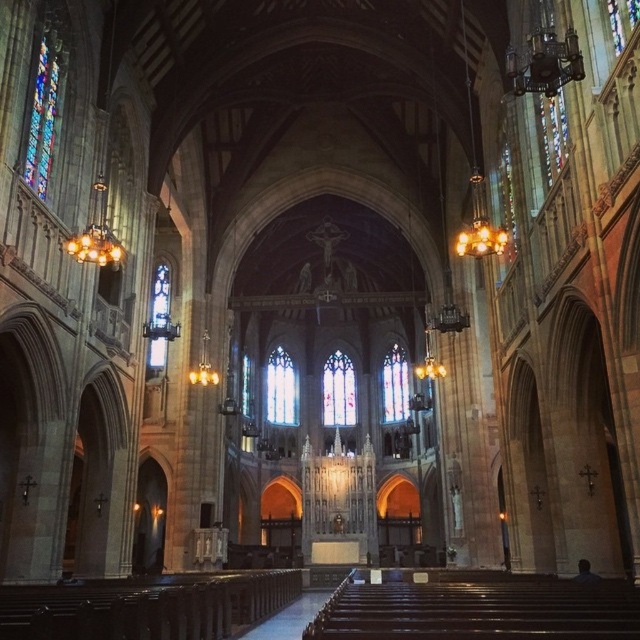
Is point (28, 173) more distant than point (154, 339)?

No, it is not.

Is stained glass window at upper left thinner than clear glass stained glass window at left?

Correct, stained glass window at upper left's width is less than clear glass stained glass window at left's.

Which is behind, point (42, 180) or point (150, 314)?

The point (150, 314) is more distant.

Identify the location of stained glass window at upper left. (44, 113).

Between stained glass window at upper left and stained glass window at center, which one appears on the left side from the viewer's perspective?

From the viewer's perspective, stained glass window at upper left appears more on the left side.

Measure the distance between point (48,138) and camera.

196.34 feet

Who is more distant from viewer, (48, 42) or (397, 362)?

The point (397, 362) is more distant.

In order to click on stained glass window at upper left in this screenshot , I will do `click(44, 113)`.

Is stained glass window at upper left above clear glass stained glass window at center?

Yes.

Is point (60, 56) farther from viewer compared to point (241, 401)?

No, (60, 56) is in front of (241, 401).

Is point (33, 116) closer to viewer compared to point (248, 410)?

Yes, point (33, 116) is in front of point (248, 410).

At what (x,y) coordinates should I click in order to perform the action: click on stained glass window at upper left. Please return your answer as a coordinate pair (x, y). The image size is (640, 640). Looking at the image, I should click on (44, 113).